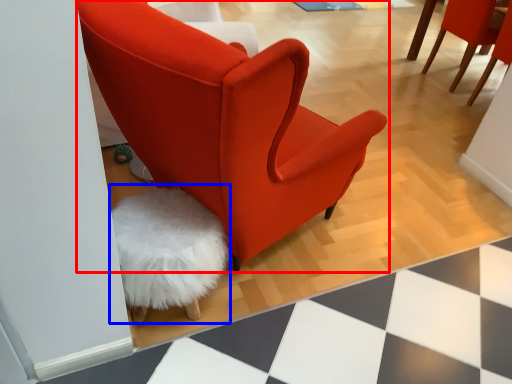
Question: Which object is closer to the camera taking this photo, chair (highlighted by a red box) or swivel chair (highlighted by a blue box)?

Choices:
 (A) chair
 (B) swivel chair

Answer: (A)